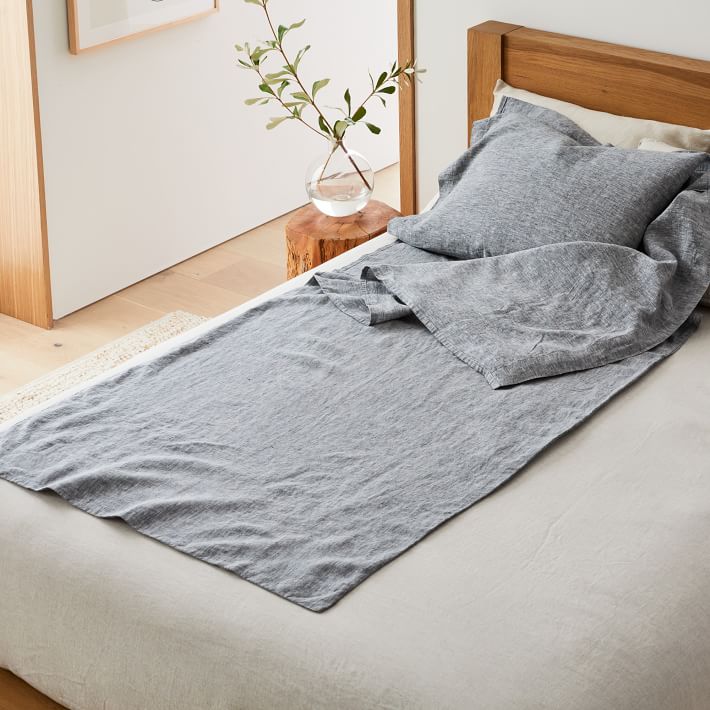
At what (x,y) coordinates should I click in order to perform the action: click on vase. Please return your answer as a coordinate pair (x, y). The width and height of the screenshot is (710, 710). Looking at the image, I should click on (337, 174).